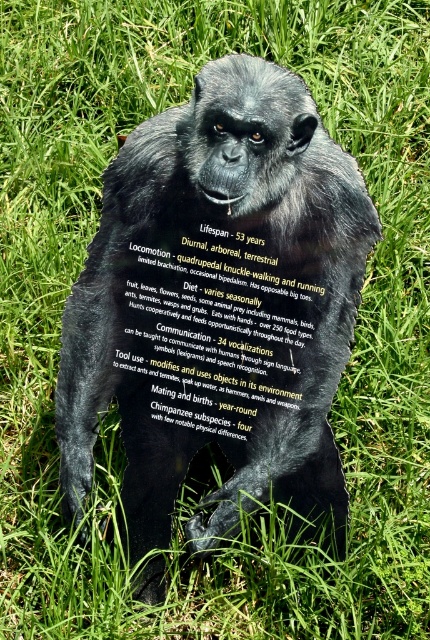
Question: Which point is closer to the camera?

Choices:
 (A) (160, 385)
 (B) (300, 186)

Answer: (B)

Question: Is shiny black statue at center further to camera compared to black plastic sign at center?

Choices:
 (A) no
 (B) yes

Answer: (A)

Question: Can you confirm if shiny black statue at center is positioned above black plastic sign at center?

Choices:
 (A) yes
 (B) no

Answer: (B)

Question: Does shiny black statue at center come in front of black plastic sign at center?

Choices:
 (A) no
 (B) yes

Answer: (B)